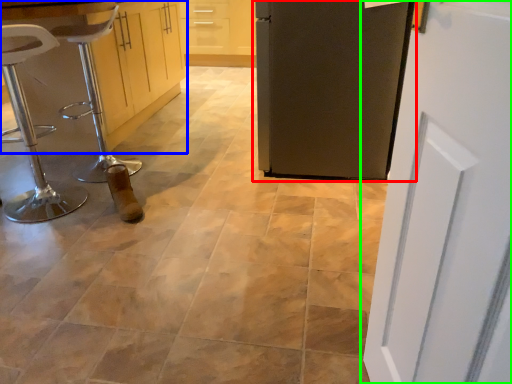
Question: Considering the real-world distances, which object is closest to door (highlighted by a red box)? cabinetry (highlighted by a blue box) or door (highlighted by a green box).

Choices:
 (A) cabinetry
 (B) door

Answer: (B)